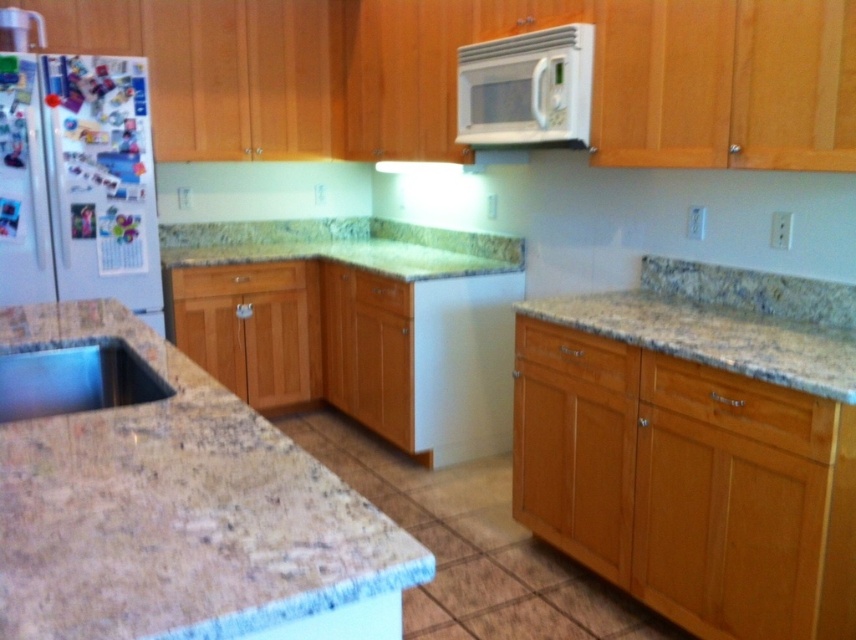
Is granite countertop at lower left taller than granite at right?

Yes, granite countertop at lower left is taller than granite at right.

Does point (34, 522) lie in front of point (795, 333)?

Yes, point (34, 522) is closer to viewer.

Between point (92, 556) and point (783, 320), which one is positioned behind?

The point (783, 320) is more distant.

At what (x,y) coordinates should I click in order to perform the action: click on granite countertop at lower left. Please return your answer as a coordinate pair (x, y). Looking at the image, I should click on (173, 504).

Which is below, granite at right or white glossy microwave at upper center?

Positioned lower is granite at right.

Can you confirm if granite at right is positioned to the right of white glossy microwave at upper center?

Indeed, granite at right is positioned on the right side of white glossy microwave at upper center.

Locate an element on the screen. The height and width of the screenshot is (640, 856). granite at right is located at coordinates (714, 337).

Locate an element on the screen. Image resolution: width=856 pixels, height=640 pixels. granite at right is located at coordinates (714, 337).

Is granite at right taller than satin silver sink at lower left?

Indeed, granite at right has a greater height compared to satin silver sink at lower left.

Which is more to the right, granite at right or satin silver sink at lower left?

From the viewer's perspective, granite at right appears more on the right side.

Does point (663, 324) come closer to viewer compared to point (45, 348)?

No, it is behind (45, 348).

Where is `granite at right`? granite at right is located at coordinates (714, 337).